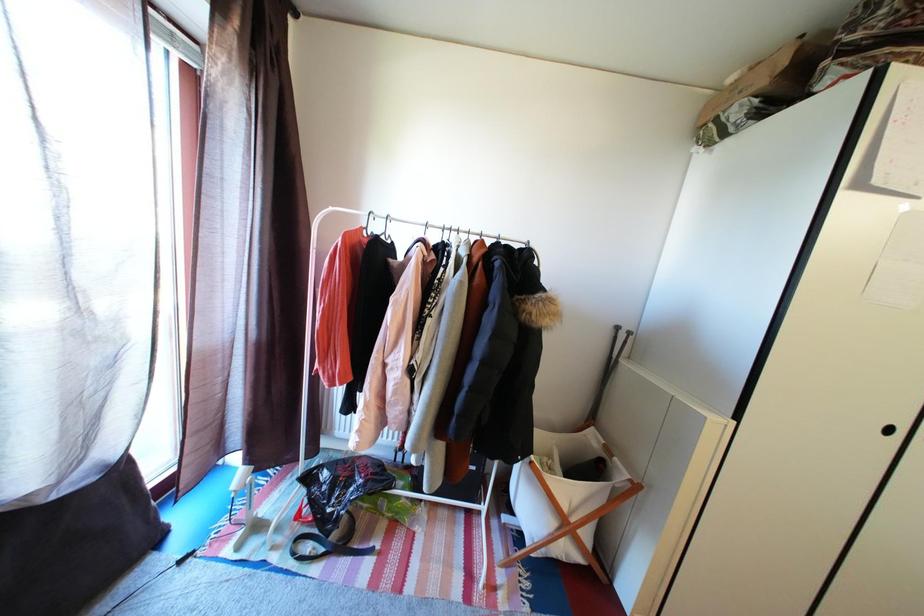
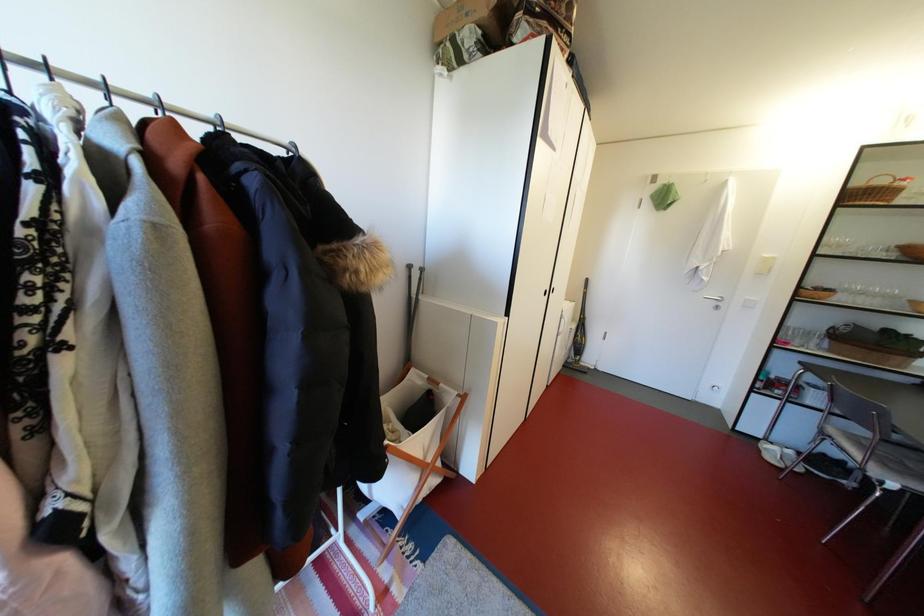
First-person continuous shooting, in which direction is the camera rotating?

The camera's rotation is toward right-down.